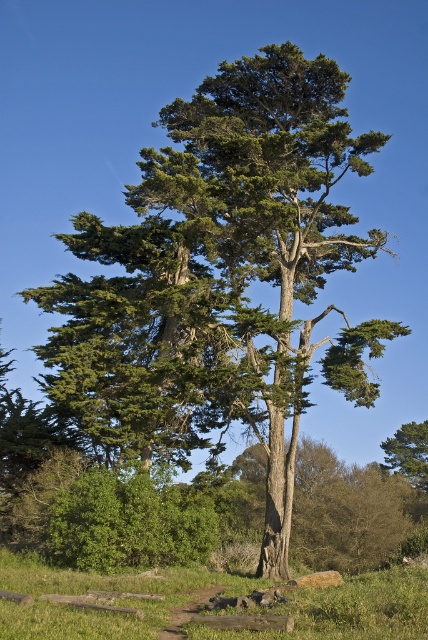
Is green grass at lower center closer to the viewer compared to green rough bark tree at lower right?

Yes, green grass at lower center is in front of green rough bark tree at lower right.

Is point (44, 604) behind point (422, 486)?

No, (44, 604) is in front of (422, 486).

Measure the distance between green grass at lower center and camera.

A distance of 9.91 meters exists between green grass at lower center and camera.

Find the location of `green grass at lower center`. green grass at lower center is located at coordinates (95, 611).